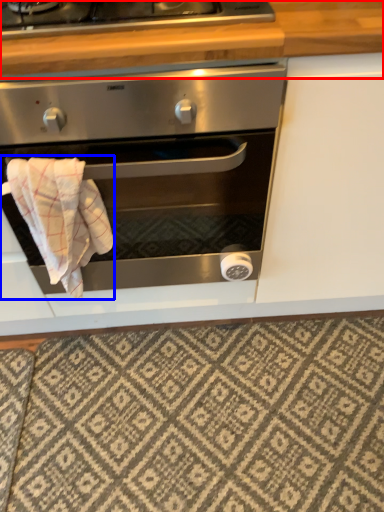
Question: Which object appears farthest to the camera in this image, counter top (highlighted by a red box) or bath towel (highlighted by a blue box)?

Choices:
 (A) counter top
 (B) bath towel

Answer: (B)